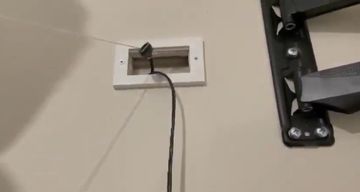
Where is `shadoe of shelf`? This screenshot has width=360, height=192. shadoe of shelf is located at coordinates (335, 27).